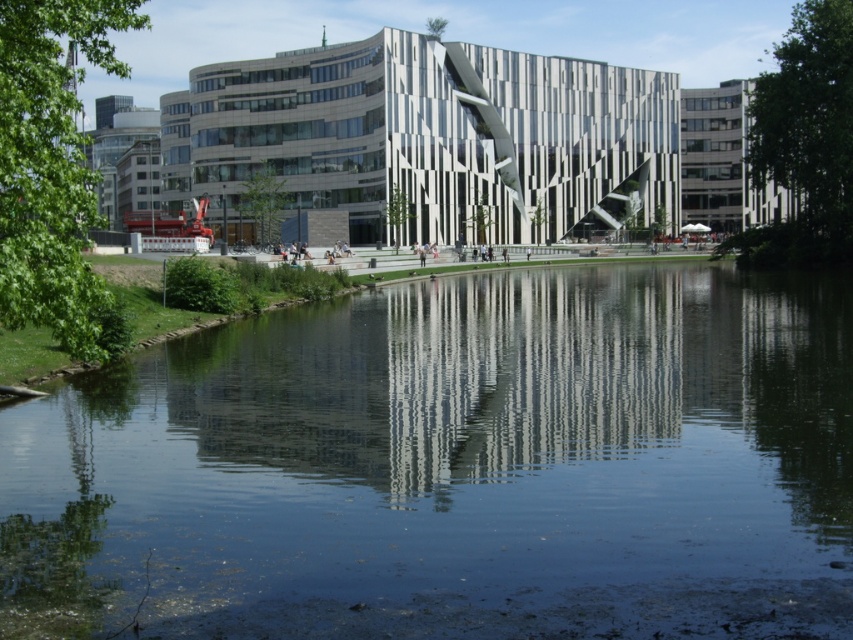
You are standing at the edge of the waterway and want to take a photo of the white striped building at center while including the transparent water at center in the frame. Given that your camera has a maximum focus range of 80 meters, will you be able to capture both objects clearly in the same photo?

The transparent water at center is 80.30 meters away from the white striped building at center. Since the camera can only focus up to 80 meters, the distance between them exceeds the camera range. Therefore, you cannot capture both objects clearly in the same photo.

You are standing in front of the modern building by the water. There are two points marked in the image. One is at coordinates point (335, 320) and the other is at point (340, 81). Which point is nearer to you?

Point (335, 320) is closer to the camera than point (340, 81), so the point at coordinates point (335, 320) is nearer to you.